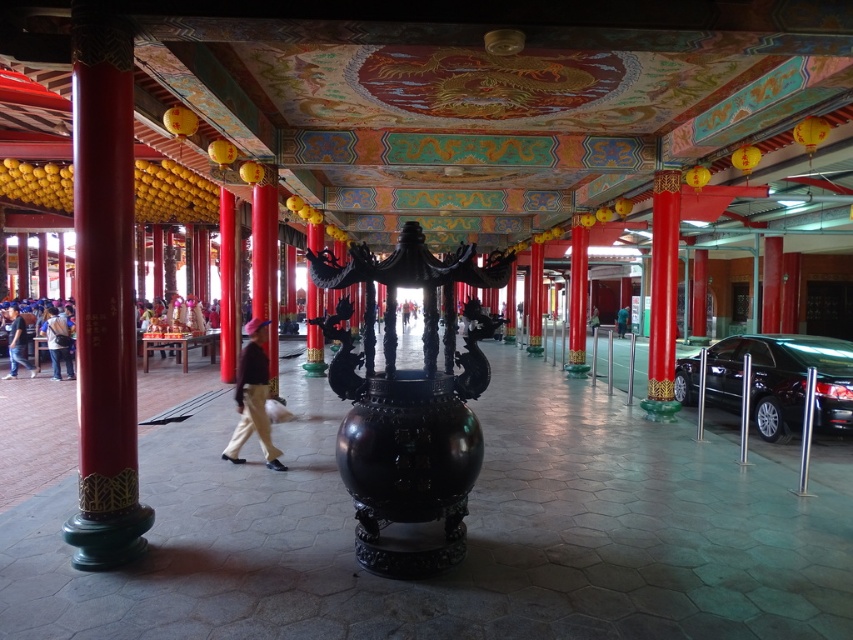
Which is above, shiny red pole at right or dark blue jeans at lower left?

shiny red pole at right is higher up.

Does point (654, 394) come in front of point (10, 308)?

Yes.

What are the coordinates of `shiny red pole at right` in the screenshot? It's located at (663, 294).

Image resolution: width=853 pixels, height=640 pixels. Identify the location of shiny red pole at right. (x=663, y=294).

Is black metallic car at right further to camera compared to shiny red pole at right?

No, it is in front of shiny red pole at right.

Is black metallic car at right to the right of shiny red pole at right from the viewer's perspective?

Yes, black metallic car at right is to the right of shiny red pole at right.

The image size is (853, 640). What do you see at coordinates (782, 380) in the screenshot?
I see `black metallic car at right` at bounding box center [782, 380].

At what (x,y) coordinates should I click in order to perform the action: click on black metallic car at right. Please return your answer as a coordinate pair (x, y). Image resolution: width=853 pixels, height=640 pixels. Looking at the image, I should click on (782, 380).

Between point (131, 188) and point (241, 444), which one is positioned behind?

The point (241, 444) is more distant.

Does glossy red pole at left appear on the left side of khaki pants at center?

Correct, you'll find glossy red pole at left to the left of khaki pants at center.

Image resolution: width=853 pixels, height=640 pixels. Identify the location of glossy red pole at left. (103, 292).